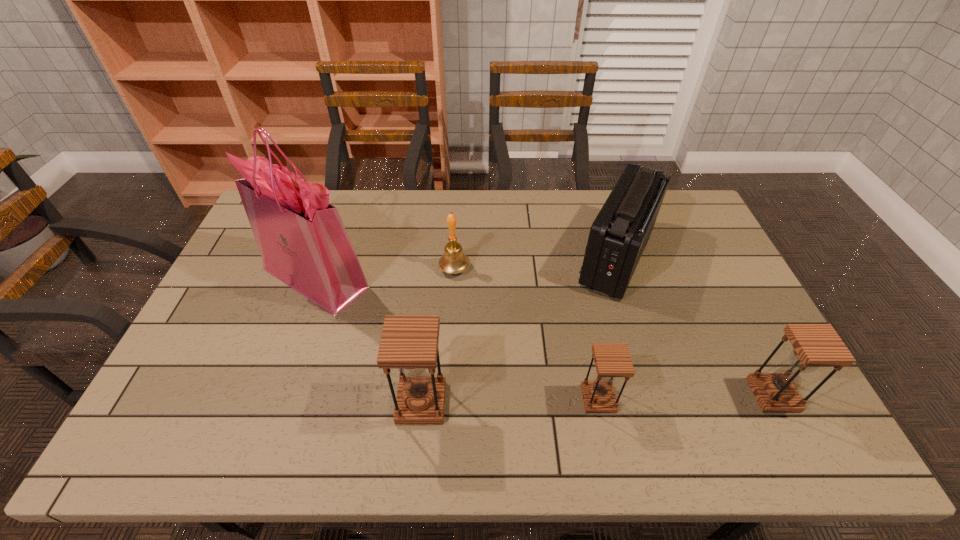
What are the coordinates of `vacant region located on the right of the shortest object` in the screenshot? It's located at (682, 399).

Locate an element on the screen. The width and height of the screenshot is (960, 540). free space located on the left of the second tallest hourglass is located at coordinates (726, 395).

Find the location of a particular element. This screenshot has height=540, width=960. vacant point located on the right of the bell is located at coordinates (566, 268).

Where is `vacant space located on the right of the tallest object`? Image resolution: width=960 pixels, height=540 pixels. vacant space located on the right of the tallest object is located at coordinates (457, 278).

Identify the location of free location located on the front panel of the radio receiver. The image size is (960, 540). (516, 258).

Where is `vacant space positioned 0.300m on the front panel of the radio receiver`? Image resolution: width=960 pixels, height=540 pixels. vacant space positioned 0.300m on the front panel of the radio receiver is located at coordinates (480, 258).

The image size is (960, 540). In order to click on vacant space located on the front panel of the radio receiver in this screenshot , I will do `click(526, 258)`.

This screenshot has width=960, height=540. Find the location of `object that is at the far edge`. object that is at the far edge is located at coordinates (618, 236).

The height and width of the screenshot is (540, 960). I want to click on object that is at the left edge, so click(303, 242).

I want to click on object present at the right edge, so click(814, 345).